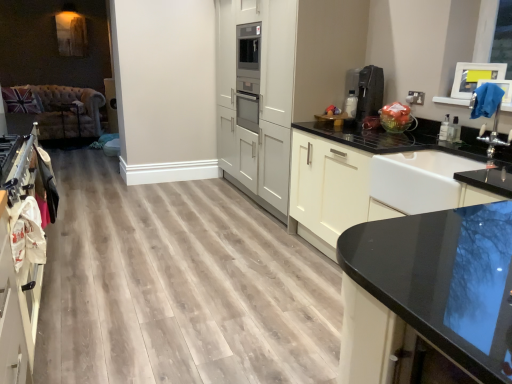
The width and height of the screenshot is (512, 384). Find the location of `free spot to the left of white glossy cabinet at center, the 1th cabinetry in the right-to-left sequence`. free spot to the left of white glossy cabinet at center, the 1th cabinetry in the right-to-left sequence is located at coordinates click(x=148, y=295).